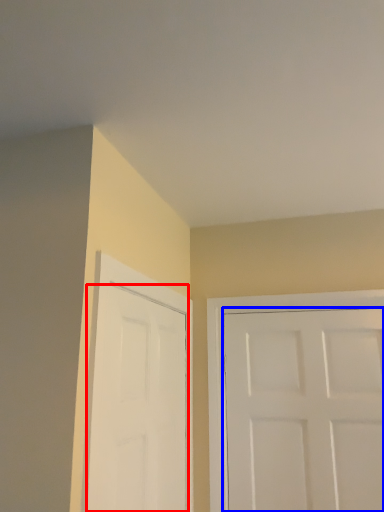
Question: Which point is closer to the camera, door (highlighted by a red box) or door (highlighted by a blue box)?

Choices:
 (A) door
 (B) door

Answer: (A)